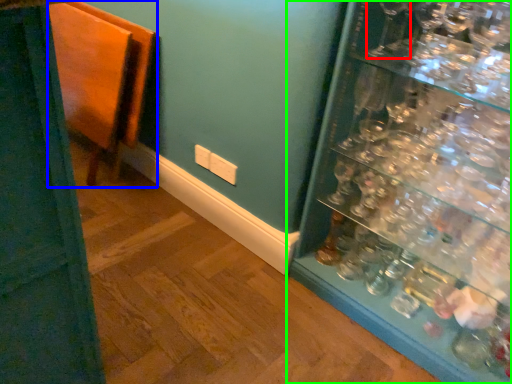
Question: Considering the real-world distances, which object is farthest from wine glass (highlighted by a red box)? furniture (highlighted by a blue box) or shelf (highlighted by a green box)?

Choices:
 (A) furniture
 (B) shelf

Answer: (A)